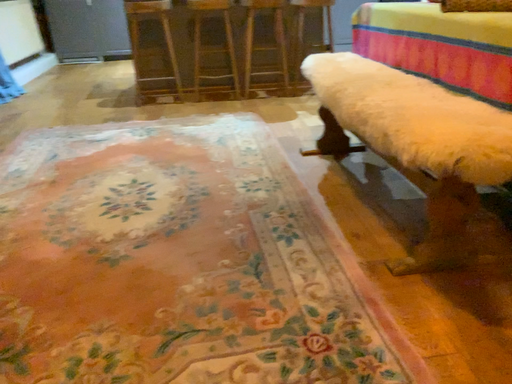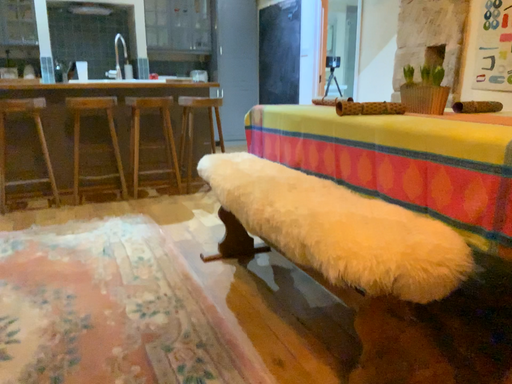
Question: How did the camera likely rotate when shooting the video?

Choices:
 (A) rotated right
 (B) rotated left

Answer: (A)